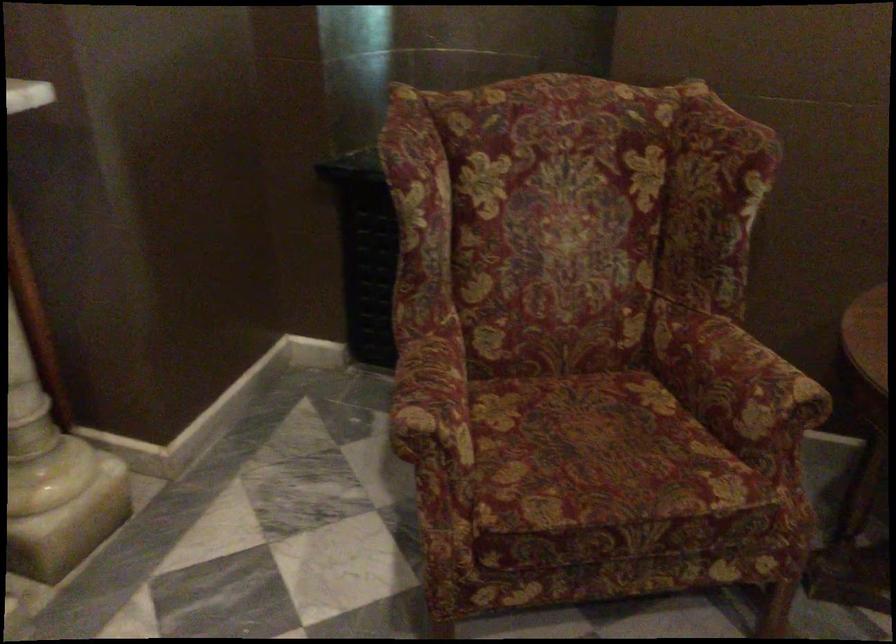
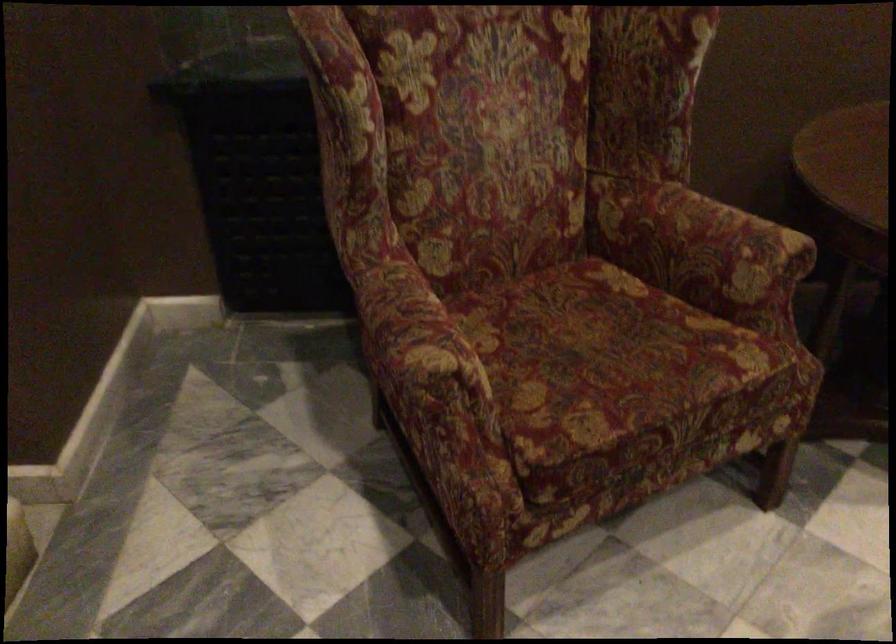
Find the pixel in the second image that matches (x=595, y=459) in the first image.

(606, 361)